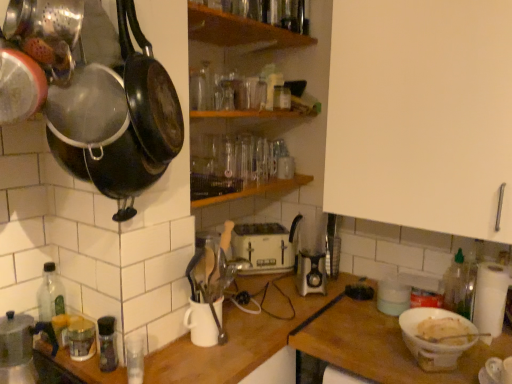
Question: Would you say white matte bowl at lower right is outside wooden shelf at center, which is counted as the 2th shelf, starting from the top?

Choices:
 (A) yes
 (B) no

Answer: (A)

Question: Considering the relative sizes of white matte bowl at lower right and wooden shelf at center, which is counted as the 2th shelf, starting from the top, in the image provided, is white matte bowl at lower right thinner than wooden shelf at center, which is counted as the 2th shelf, starting from the top,?

Choices:
 (A) yes
 (B) no

Answer: (A)

Question: Considering the relative sizes of white matte bowl at lower right and wooden shelf at center, which is counted as the 2th shelf, starting from the top, in the image provided, is white matte bowl at lower right shorter than wooden shelf at center, which is counted as the 2th shelf, starting from the top,?

Choices:
 (A) yes
 (B) no

Answer: (B)

Question: Considering the relative sizes of white matte bowl at lower right and wooden shelf at center, which is counted as the 2th shelf, starting from the top, in the image provided, is white matte bowl at lower right bigger than wooden shelf at center, which is counted as the 2th shelf, starting from the top,?

Choices:
 (A) yes
 (B) no

Answer: (B)

Question: Is white matte bowl at lower right at the right side of wooden shelf at center, which ranks as the 1th shelf in bottom-to-top order?

Choices:
 (A) no
 (B) yes

Answer: (B)

Question: From a real-world perspective, is wooden cutting board at center, the first table positioned from the left, positioned above or below black matte frying pan at upper left, which is the 1th frying pan from right to left?

Choices:
 (A) above
 (B) below

Answer: (B)

Question: Is wooden cutting board at center, the first table positioned from the left, to the left or to the right of black matte frying pan at upper left, which is the 1th frying pan from right to left, in the image?

Choices:
 (A) right
 (B) left

Answer: (A)

Question: Is wooden cutting board at center, the second table in the right-to-left sequence, bigger or smaller than black matte frying pan at upper left, which is the 3th frying pan in left-to-right order?

Choices:
 (A) big
 (B) small

Answer: (A)

Question: From the image's perspective, is wooden cutting board at center, the second table in the right-to-left sequence, positioned above or below black matte frying pan at upper left, which is the 3th frying pan in left-to-right order?

Choices:
 (A) below
 (B) above

Answer: (A)

Question: From a real-world perspective, is black matte frying pan at upper left, which is the 3th frying pan in left-to-right order, above or below metallic black frying pan at upper left, positioned as the 1th frying pan in left-to-right order?

Choices:
 (A) below
 (B) above

Answer: (A)

Question: From the image's perspective, is black matte frying pan at upper left, which is the 1th frying pan from right to left, above or below metallic black frying pan at upper left, positioned as the 1th frying pan in left-to-right order?

Choices:
 (A) above
 (B) below

Answer: (A)

Question: Visually, is black matte frying pan at upper left, which is the 1th frying pan from right to left, positioned to the left or to the right of metallic black frying pan at upper left, positioned as the 1th frying pan in left-to-right order?

Choices:
 (A) right
 (B) left

Answer: (A)

Question: In the image, is black matte frying pan at upper left, which is the 3th frying pan in left-to-right order, positioned in front of or behind metallic black frying pan at upper left, positioned as the 1th frying pan in left-to-right order?

Choices:
 (A) behind
 (B) front

Answer: (A)

Question: From the image's perspective, is white plastic toaster at center positioned above or below white matte bowl at lower right, which ranks as the 2th table in left-to-right order?

Choices:
 (A) below
 (B) above

Answer: (B)

Question: Considering the positions of white plastic toaster at center and white matte bowl at lower right, the 1th table viewed from the right, in the image, is white plastic toaster at center wider or thinner than white matte bowl at lower right, the 1th table viewed from the right,?

Choices:
 (A) thin
 (B) wide

Answer: (A)